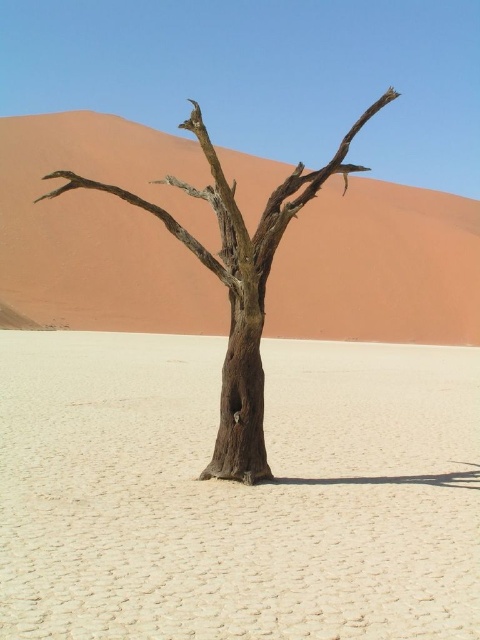
Which is below, dried mud tree at center or brown rough tree at center?

Positioned lower is dried mud tree at center.

The image size is (480, 640). I want to click on dried mud tree at center, so [x=237, y=492].

The image size is (480, 640). I want to click on dried mud tree at center, so click(237, 492).

Which is more to the left, brown rough tree at center or dark brown rough tree trunk at center?

From the viewer's perspective, dark brown rough tree trunk at center appears more on the left side.

Describe the element at coordinates (239, 284) in the screenshot. I see `brown rough tree at center` at that location.

In order to click on brown rough tree at center in this screenshot , I will do `click(239, 284)`.

Does point (320, 593) lie behind point (230, 465)?

That is False.

At what (x,y) coordinates should I click in order to perform the action: click on dried mud tree at center. Please return your answer as a coordinate pair (x, y). Looking at the image, I should click on (237, 492).

The image size is (480, 640). What do you see at coordinates (237, 492) in the screenshot? I see `dried mud tree at center` at bounding box center [237, 492].

Where is `dried mud tree at center`? dried mud tree at center is located at coordinates (237, 492).